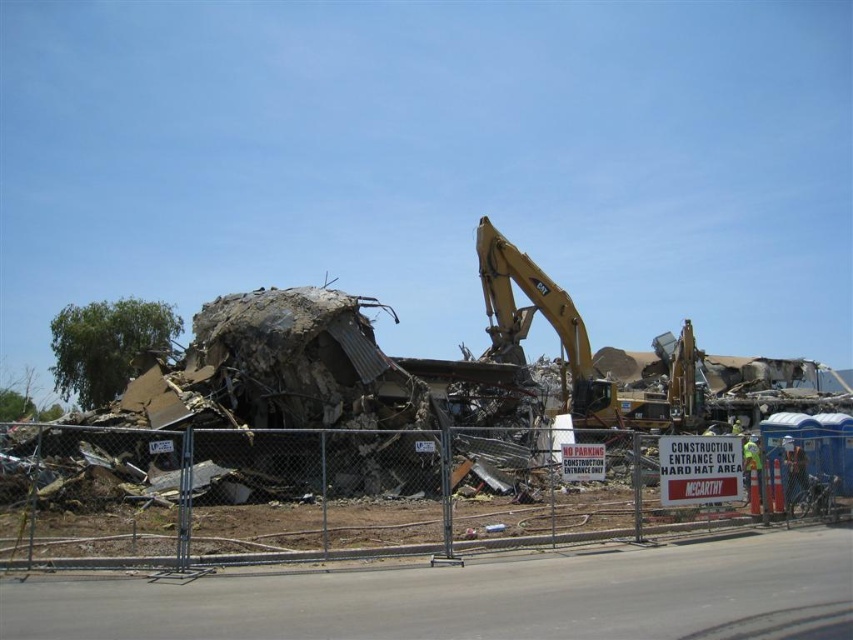
Question: Can you confirm if metal chain-link fence at center is positioned below yellow metallic excavator at center?

Choices:
 (A) no
 (B) yes

Answer: (B)

Question: Among these objects, which one is nearest to the camera?

Choices:
 (A) yellow metallic excavator at center
 (B) metal chain-link fence at center

Answer: (B)

Question: Is metal chain-link fence at center to the left of yellow metallic excavator at center from the viewer's perspective?

Choices:
 (A) yes
 (B) no

Answer: (A)

Question: From the image, what is the correct spatial relationship of metal chain-link fence at center in relation to yellow metallic excavator at center?

Choices:
 (A) right
 (B) left

Answer: (B)